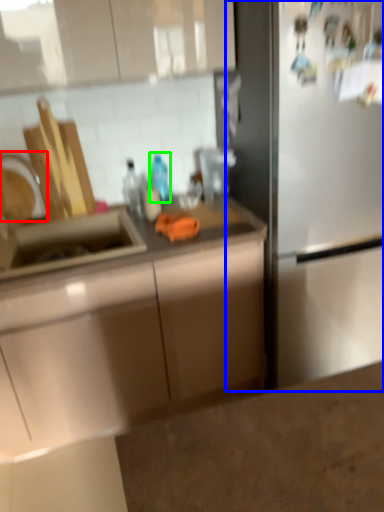
Question: Based on their relative distances, which object is nearer to faucet (highlighted by a red box)? Choose from fridge (highlighted by a blue box) and bottle (highlighted by a green box).

Choices:
 (A) fridge
 (B) bottle

Answer: (B)